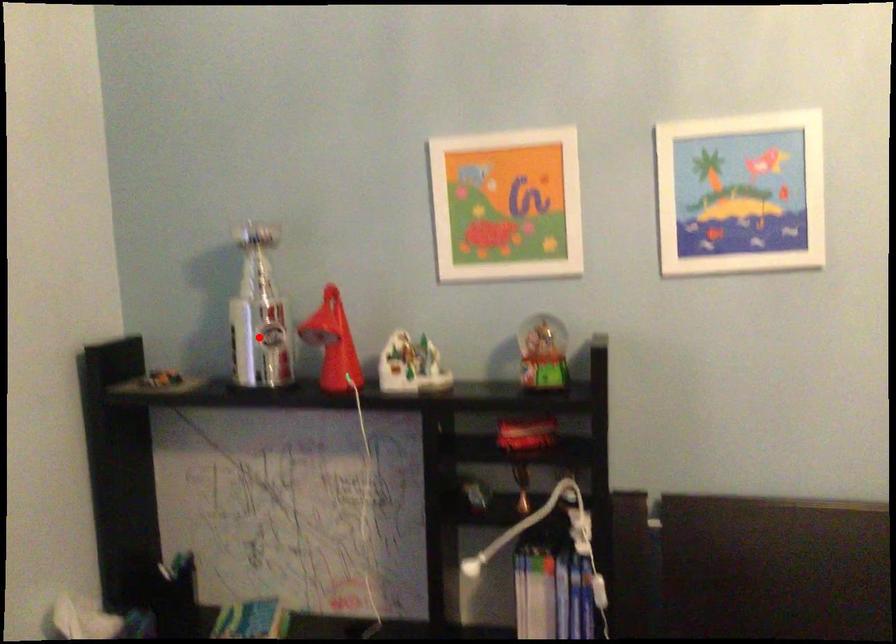
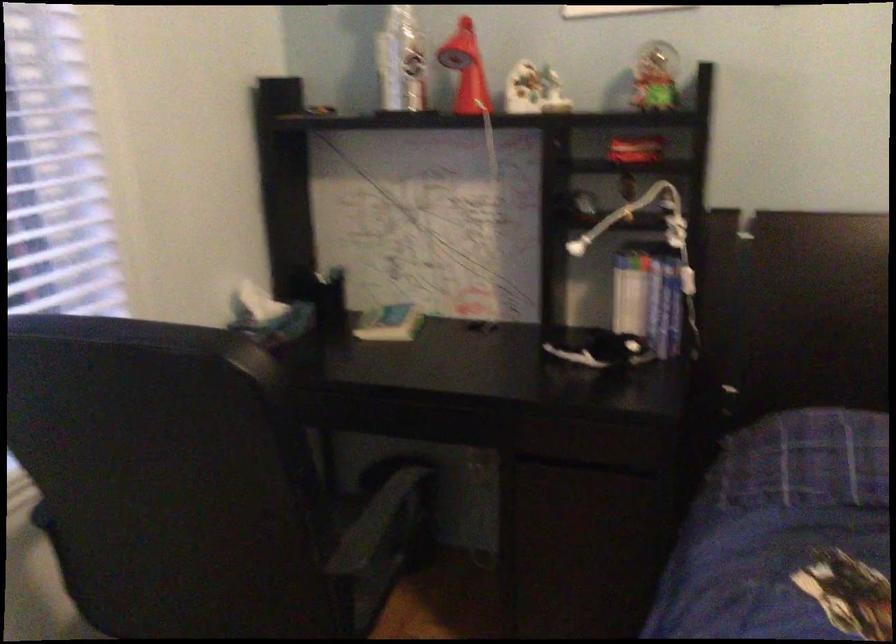
Question: I am providing you with two images of the same scene from different viewpoints. Given a red point in image1, look at the same physical point in image2. Is it:

Choices:
 (A) Closer to the viewpoint
 (B) Farther from the viewpoint

Answer: (B)